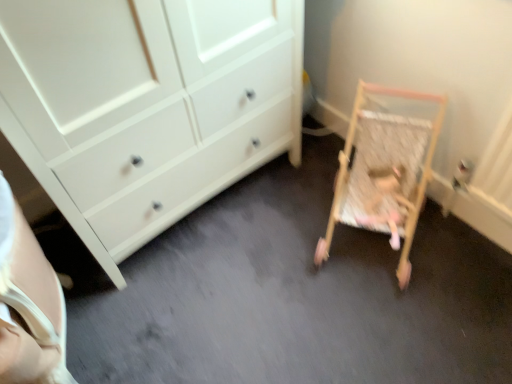
Describe the element at coordinates (384, 172) in the screenshot. This screenshot has height=384, width=512. I see `wooden baby cot at lower right` at that location.

Where is `wooden baby cot at lower right`? wooden baby cot at lower right is located at coordinates (384, 172).

Locate an element on the screen. wooden rocking chair at right is located at coordinates (387, 202).

The image size is (512, 384). What do you see at coordinates (387, 202) in the screenshot?
I see `wooden rocking chair at right` at bounding box center [387, 202].

Identify the location of wooden baby cot at lower right. (384, 172).

Which is more to the left, wooden baby cot at lower right or wooden rocking chair at right?

wooden baby cot at lower right is more to the left.

Which object is more forward, wooden baby cot at lower right or wooden rocking chair at right?

wooden baby cot at lower right.

Considering the points (357, 188) and (407, 210), which point is behind, point (357, 188) or point (407, 210)?

The point (357, 188) is more distant.

From the image's perspective, which one is positioned lower, wooden baby cot at lower right or wooden rocking chair at right?

From the image's view, wooden rocking chair at right is below.

From a real-world perspective, which object stands above the other?

wooden baby cot at lower right.

Considering the relative sizes of wooden baby cot at lower right and wooden rocking chair at right in the image provided, is wooden baby cot at lower right thinner than wooden rocking chair at right?

In fact, wooden baby cot at lower right might be wider than wooden rocking chair at right.

Considering the relative sizes of wooden baby cot at lower right and wooden rocking chair at right in the image provided, is wooden baby cot at lower right shorter than wooden rocking chair at right?

Incorrect, the height of wooden baby cot at lower right does not fall short of that of wooden rocking chair at right.

Based on the photo, can you confirm if wooden baby cot at lower right is bigger than wooden rocking chair at right?

Indeed, wooden baby cot at lower right has a larger size compared to wooden rocking chair at right.

Is wooden baby cot at lower right inside the boundaries of wooden rocking chair at right, or outside?

wooden baby cot at lower right cannot be found inside wooden rocking chair at right.

Are wooden baby cot at lower right and wooden rocking chair at right far apart?

Actually, wooden baby cot at lower right and wooden rocking chair at right are a little close together.

Is wooden baby cot at lower right oriented towards wooden rocking chair at right?

Yes, wooden baby cot at lower right is turned towards wooden rocking chair at right.

Consider the image. How different are the orientations of wooden baby cot at lower right and wooden rocking chair at right in degrees?

They differ by 0.000437 degrees in their facing directions.

Measure the distance from wooden baby cot at lower right to wooden rocking chair at right.

wooden baby cot at lower right is 3.08 inches away from wooden rocking chair at right.

Locate an element on the screen. furniture on the left of wooden rocking chair at right is located at coordinates (384, 172).

In the scene shown: Does wooden rocking chair at right appear on the right side of wooden baby cot at lower right?

Yes, wooden rocking chair at right is to the right of wooden baby cot at lower right.

Who is more distant, wooden rocking chair at right or wooden baby cot at lower right?

wooden rocking chair at right is further away from the camera.

Is point (397, 238) farther from camera compared to point (366, 225)?

That is False.

From the image's perspective, which one is positioned lower, wooden rocking chair at right or wooden baby cot at lower right?

wooden rocking chair at right.

Based on the photo, from a real-world perspective, is wooden rocking chair at right physically above wooden baby cot at lower right?

No, from a real-world perspective, wooden rocking chair at right is not above wooden baby cot at lower right.

Can you confirm if wooden rocking chair at right is thinner than wooden baby cot at lower right?

Yes.

From their relative heights in the image, would you say wooden rocking chair at right is taller or shorter than wooden baby cot at lower right?

In the image, wooden rocking chair at right appears to be shorter than wooden baby cot at lower right.

In the scene shown: Can you confirm if wooden rocking chair at right is bigger than wooden baby cot at lower right?

Actually, wooden rocking chair at right might be smaller than wooden baby cot at lower right.

Is wooden rocking chair at right not inside wooden baby cot at lower right?

That's incorrect, wooden rocking chair at right is not completely outside wooden baby cot at lower right.

Is wooden rocking chair at right placed right next to wooden baby cot at lower right?

Indeed, wooden rocking chair at right and wooden baby cot at lower right are beside each other and touching.

Is wooden rocking chair at right aimed at wooden baby cot at lower right?

Yes, wooden rocking chair at right is facing wooden baby cot at lower right.

The height and width of the screenshot is (384, 512). In order to click on person that appears on the right of wooden baby cot at lower right in this screenshot , I will do `click(387, 202)`.

I want to click on furniture above the wooden rocking chair at right (from a real-world perspective), so pyautogui.click(x=384, y=172).

I want to click on person behind the wooden baby cot at lower right, so click(x=387, y=202).